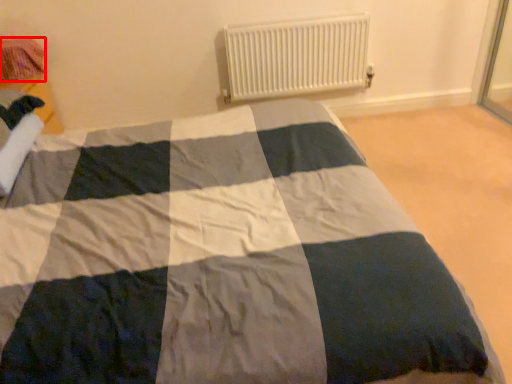
Question: From the image's perspective, where is material (annotated by the red box) located relative to radiator?

Choices:
 (A) above
 (B) below

Answer: (B)